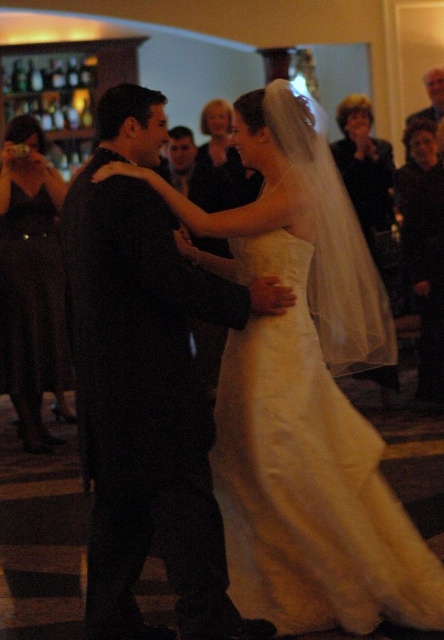
Which is below, black satin suit at center or satin dress at center?

Positioned lower is black satin suit at center.

Can you confirm if black satin suit at center is thinner than satin dress at center?

No, black satin suit at center is not thinner than satin dress at center.

Is point (143, 346) farther from camera compared to point (228, 157)?

That is False.

I want to click on black satin suit at center, so click(146, 387).

Does satin dress at center have a larger size compared to dark brown leather jacket at center?

Correct, satin dress at center is larger in size than dark brown leather jacket at center.

In order to click on satin dress at center in this screenshot , I will do pos(221,164).

From the picture: Between black satin suit at center and matte black dress at left, which one is positioned higher?

matte black dress at left

Is black satin suit at center bigger than matte black dress at left?

Incorrect, black satin suit at center is not larger than matte black dress at left.

This screenshot has height=640, width=444. Find the location of `black satin suit at center`. black satin suit at center is located at coordinates (146, 387).